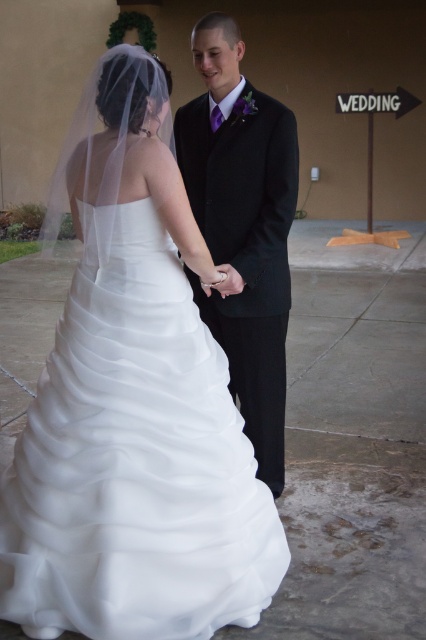
This screenshot has height=640, width=426. Describe the element at coordinates (135, 460) in the screenshot. I see `white satin dress at center` at that location.

Is point (160, 280) more distant than point (239, 276)?

No, it is in front of (239, 276).

At what (x,y) coordinates should I click in order to perform the action: click on white satin dress at center. Please return your answer as a coordinate pair (x, y). This screenshot has width=426, height=640. Looking at the image, I should click on (135, 460).